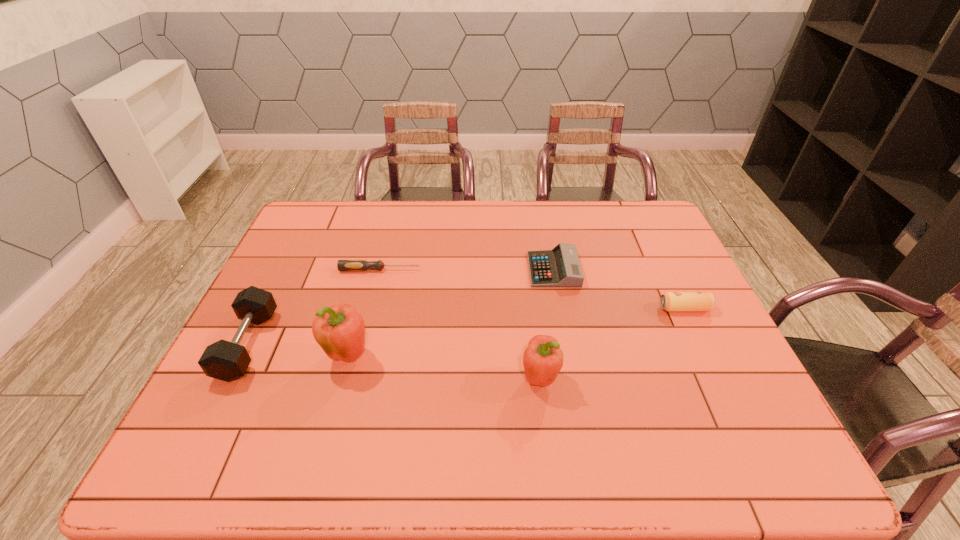
In the image, there is a desktop. Identify the location of vacant space at the left edge. (285, 256).

Identify the location of free region at the right edge of the desktop. (646, 271).

In order to click on vacant space at the far left corner of the desktop in this screenshot , I will do `click(331, 225)`.

This screenshot has width=960, height=540. In the image, there is a desktop. Find the location of `vacant space at the near right corner`. vacant space at the near right corner is located at coordinates (743, 416).

Find the location of a particular element. The height and width of the screenshot is (540, 960). free space between the rightmost object and the shortest object is located at coordinates (532, 289).

This screenshot has height=540, width=960. Identify the location of free space between the fourth shortest object and the calculator. (400, 307).

Where is `free spot between the screwdriver and the dumbbell`? The height and width of the screenshot is (540, 960). free spot between the screwdriver and the dumbbell is located at coordinates (314, 307).

Where is `free space between the leftmost object and the shortest object`? The height and width of the screenshot is (540, 960). free space between the leftmost object and the shortest object is located at coordinates (314, 307).

The height and width of the screenshot is (540, 960). What are the coordinates of `empty space that is in between the dumbbell and the rightmost object` in the screenshot? It's located at (467, 327).

The image size is (960, 540). What are the coordinates of `free space between the second tallest object and the tallest object` in the screenshot? It's located at (444, 368).